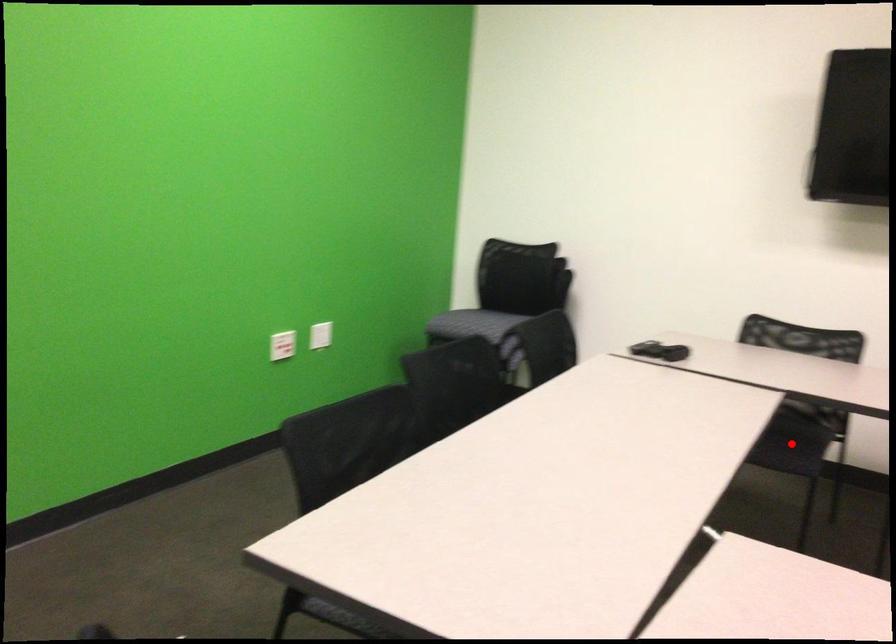
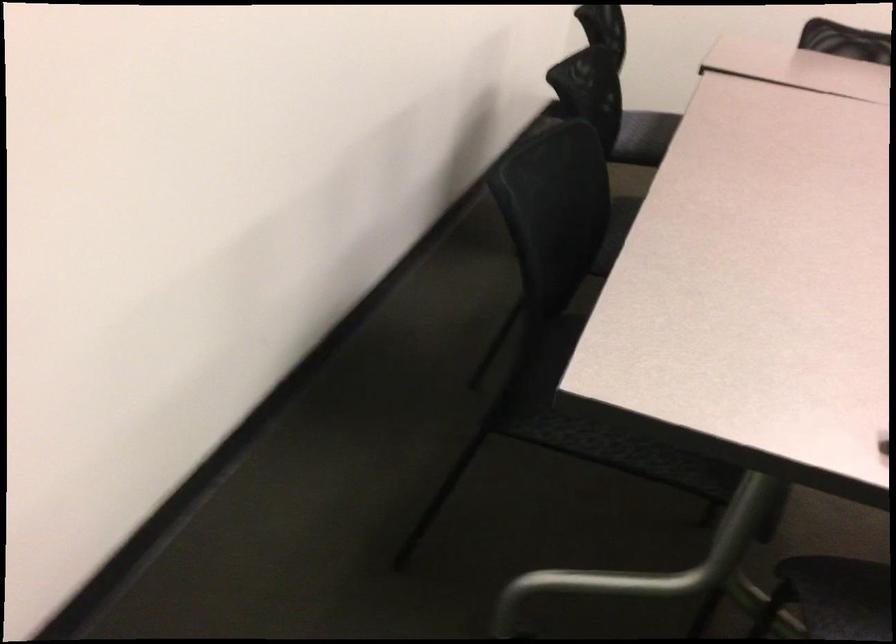
Question: I am providing you with two images of the same scene from different viewpoints. A red point is marked on the first image. At the location where the point appears in image 1, is it still visible in image 2?

Choices:
 (A) Yes
 (B) No

Answer: (B)